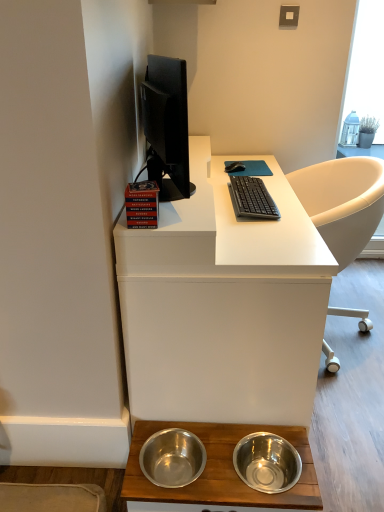
Describe the element at coordinates (235, 167) in the screenshot. I see `black rubber mouse at center` at that location.

You are a GUI agent. You are given a task and a screenshot of the screen. Output one action in this format:
    pyautogui.click(x=<x>, y=<y>)
    Task: Click on the black rubber mouse at center
    
    Given the screenshot: What is the action you would take?
    pyautogui.click(x=235, y=167)

This screenshot has width=384, height=512. Describe the element at coordinates (219, 471) in the screenshot. I see `stainless steel bowls at lower center, marked as the 1th desk in a bottom-to-top arrangement` at that location.

Where is `black rubber mouse at center`? black rubber mouse at center is located at coordinates (235, 167).

How different are the orientations of white leather chair at right and black plastic keyboard at center in degrees?

The angle between the facing direction of white leather chair at right and the facing direction of black plastic keyboard at center is 180 degrees.

From a real-world perspective, who is located higher, white leather chair at right or black plastic keyboard at center?

From a 3D spatial view, black plastic keyboard at center is above.

Which object is positioned more to the right, white leather chair at right or black plastic keyboard at center?

From the viewer's perspective, white leather chair at right appears more on the right side.

Could you tell me if stainless steel bowls at lower center, marked as the 1th desk in a bottom-to-top arrangement, is facing black plastic keyboard at center?

No, stainless steel bowls at lower center, marked as the 1th desk in a bottom-to-top arrangement, is not turned towards black plastic keyboard at center.

Identify the location of computer keyboard behind the stainless steel bowls at lower center, which is the second desk from top to bottom. The width and height of the screenshot is (384, 512). (252, 198).

Considering the points (241, 437) and (259, 178), which point is behind, point (241, 437) or point (259, 178)?

Positioned behind is point (259, 178).

What's the angular difference between stainless steel bowls at lower center, marked as the 1th desk in a bottom-to-top arrangement, and black plastic keyboard at center's facing directions?

stainless steel bowls at lower center, marked as the 1th desk in a bottom-to-top arrangement, and black plastic keyboard at center are facing 90.5 degrees away from each other.

Is black rubber mouse at center at the left side of white matte desk at center, arranged as the 2th desk when ordered from the bottom?

Incorrect, black rubber mouse at center is not on the left side of white matte desk at center, arranged as the 2th desk when ordered from the bottom.

Is black rubber mouse at center next to white matte desk at center, arranged as the 2th desk when ordered from the bottom, and touching it?

No, black rubber mouse at center is not in contact with white matte desk at center, arranged as the 2th desk when ordered from the bottom.

Is black rubber mouse at center further to camera compared to white matte desk at center, which appears as the first desk when viewed from the top?

Yes, black rubber mouse at center is further from the camera.

Where is `mouse that is above the white matte desk at center, which appears as the first desk when viewed from the top (from the image's perspective)`? mouse that is above the white matte desk at center, which appears as the first desk when viewed from the top (from the image's perspective) is located at coordinates (235, 167).

Is black plastic keyboard at center closer to camera compared to white leather chair at right?

Yes.

From the image's perspective, is black plastic keyboard at center positioned above or below white leather chair at right?

From the image's perspective, black plastic keyboard at center appears above white leather chair at right.

Measure the distance between black plastic keyboard at center and white leather chair at right.

black plastic keyboard at center and white leather chair at right are 14.12 inches apart from each other.

How many degrees apart are the facing directions of black plastic keyboard at center and stainless steel bowls at lower center, which is the second desk from top to bottom?

The angle between the facing direction of black plastic keyboard at center and the facing direction of stainless steel bowls at lower center, which is the second desk from top to bottom, is 90.5 degrees.

Does point (257, 181) appear closer or farther from the camera than point (292, 498)?

Clearly, point (257, 181) is more distant from the camera than point (292, 498).

Does black plastic keyboard at center appear on the right side of stainless steel bowls at lower center, marked as the 1th desk in a bottom-to-top arrangement?

Correct, you'll find black plastic keyboard at center to the right of stainless steel bowls at lower center, marked as the 1th desk in a bottom-to-top arrangement.

From the black plastic keyboard at center, count 1st desks forward and point to it. Please provide its 2D coordinates.

[(219, 471)]

From the image's perspective, which is below, stainless steel bowls at lower center, marked as the 1th desk in a bottom-to-top arrangement, or white leather chair at right?

stainless steel bowls at lower center, marked as the 1th desk in a bottom-to-top arrangement, appears lower in the image.

Which object is positioned more to the left, stainless steel bowls at lower center, which is the second desk from top to bottom, or white leather chair at right?

stainless steel bowls at lower center, which is the second desk from top to bottom.

Which of these two, stainless steel bowls at lower center, which is the second desk from top to bottom, or white leather chair at right, stands taller?

Standing taller between the two is white leather chair at right.

Looking at this image, could you tell me if stainless steel bowls at lower center, which is the second desk from top to bottom, is turned towards white leather chair at right?

No, stainless steel bowls at lower center, which is the second desk from top to bottom, is not oriented towards white leather chair at right.

Based on the photo, is white matte desk at center, arranged as the 2th desk when ordered from the bottom, touching white leather chair at right?

No, white matte desk at center, arranged as the 2th desk when ordered from the bottom, is not beside white leather chair at right.

Does point (225, 261) come farther from viewer compared to point (358, 219)?

No, it is in front of (358, 219).

Looking at this image, is white matte desk at center, which appears as the first desk when viewed from the top, positioned with its back to white leather chair at right?

Yes, white matte desk at center, which appears as the first desk when viewed from the top, is facing away from white leather chair at right.

Where is `chair behind the black plastic keyboard at center`? chair behind the black plastic keyboard at center is located at coordinates (342, 202).

Find the location of a particular element. The width and height of the screenshot is (384, 512). computer keyboard above the stainless steel bowls at lower center, which is the second desk from top to bottom (from the image's perspective) is located at coordinates (252, 198).

Which object lies nearer to the anchor point stainless steel bowls at lower center, marked as the 1th desk in a bottom-to-top arrangement, black rubber mouse at center or white leather chair at right?

white leather chair at right is closer to stainless steel bowls at lower center, marked as the 1th desk in a bottom-to-top arrangement.

Considering their positions, is white leather chair at right positioned closer to black rubber mouse at center than black plastic keyboard at center?

black plastic keyboard at center lies closer to black rubber mouse at center than the other object.

Considering their positions, is stainless steel bowls at lower center, which is the second desk from top to bottom, positioned closer to white leather chair at right than black rubber mouse at center?

The object closer to white leather chair at right is black rubber mouse at center.

Which object lies nearer to the anchor point white leather chair at right, black rubber mouse at center or stainless steel bowls at lower center, which is the second desk from top to bottom?

black rubber mouse at center.

Estimate the real-world distances between objects in this image. Which object is further from black plastic keyboard at center, stainless steel bowls at lower center, marked as the 1th desk in a bottom-to-top arrangement, or black rubber mouse at center?

Based on the image, stainless steel bowls at lower center, marked as the 1th desk in a bottom-to-top arrangement, appears to be further to black plastic keyboard at center.

Estimate the real-world distances between objects in this image. Which object is closer to white matte desk at center, which appears as the first desk when viewed from the top, stainless steel bowls at lower center, which is the second desk from top to bottom, or black plastic keyboard at center?

black plastic keyboard at center is positioned closer to the anchor white matte desk at center, which appears as the first desk when viewed from the top.

From the image, which object appears to be farther from black rubber mouse at center, white matte desk at center, arranged as the 2th desk when ordered from the bottom, or stainless steel bowls at lower center, marked as the 1th desk in a bottom-to-top arrangement?

stainless steel bowls at lower center, marked as the 1th desk in a bottom-to-top arrangement, lies further to black rubber mouse at center than the other object.

From the image, which object appears to be farther from white matte desk at center, which appears as the first desk when viewed from the top, stainless steel bowls at lower center, which is the second desk from top to bottom, or white leather chair at right?

The object further to white matte desk at center, which appears as the first desk when viewed from the top, is white leather chair at right.

Where is `computer keyboard between white matte desk at center, arranged as the 2th desk when ordered from the bottom, and white leather chair at right from front to back`? This screenshot has width=384, height=512. computer keyboard between white matte desk at center, arranged as the 2th desk when ordered from the bottom, and white leather chair at right from front to back is located at coordinates 252,198.

In order to click on computer keyboard between white matte desk at center, which appears as the first desk when viewed from the top, and black rubber mouse at center from front to back in this screenshot , I will do `click(252, 198)`.

Where is `computer keyboard between black rubber mouse at center and stainless steel bowls at lower center, which is the second desk from top to bottom, vertically`? Image resolution: width=384 pixels, height=512 pixels. computer keyboard between black rubber mouse at center and stainless steel bowls at lower center, which is the second desk from top to bottom, vertically is located at coordinates (252, 198).

You are a GUI agent. You are given a task and a screenshot of the screen. Output one action in this format:
    pyautogui.click(x=<x>, y=<y>)
    Task: Click on the chair between black plastic keyboard at center and stainless steel bowls at lower center, which is the second desk from top to bottom, in the up-down direction
    
    Given the screenshot: What is the action you would take?
    [342, 202]